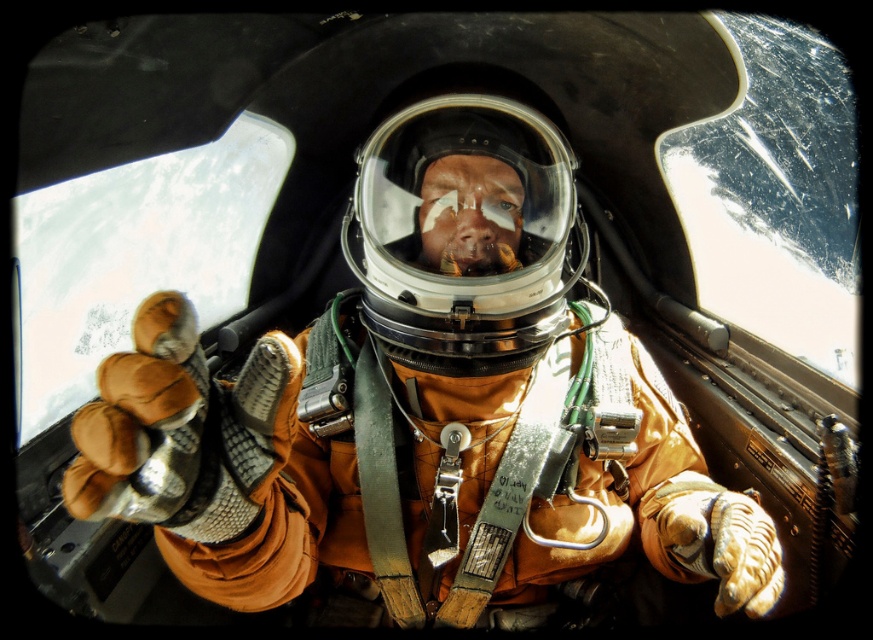
Where is `orange fabric astronaut at center`? The height and width of the screenshot is (640, 873). orange fabric astronaut at center is located at coordinates (423, 406).

Between point (198, 396) and point (436, 179), which one is positioned behind?

The point (436, 179) is more distant.

Who is more distant from viewer, (x=638, y=342) or (x=363, y=307)?

Positioned behind is point (x=638, y=342).

The width and height of the screenshot is (873, 640). I want to click on orange fabric astronaut at center, so click(423, 406).